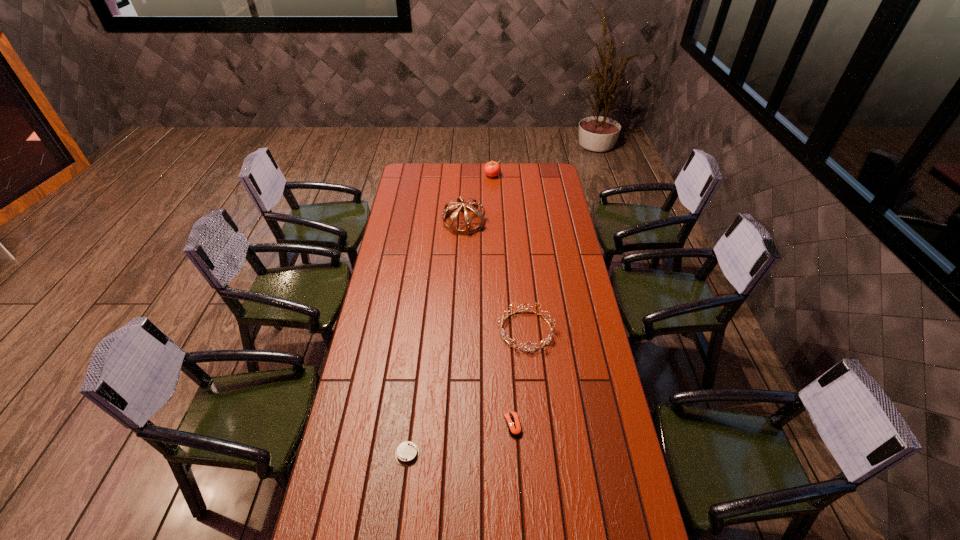
The width and height of the screenshot is (960, 540). What are the coordinates of `vacant point located 0.150m on the right of the taller tiara` in the screenshot? It's located at (515, 222).

You are a GUI agent. You are given a task and a screenshot of the screen. Output one action in this format:
    pyautogui.click(x=<x>, y=<y>)
    Task: Click on the free space located 0.310m on the left of the fourth shortest object
    
    Given the screenshot: What is the action you would take?
    pyautogui.click(x=431, y=176)

At what (x,y) coordinates should I click in order to perform the action: click on vacant region located 0.240m on the front-facing side of the shorter tiara. Please return your answer as a coordinate pair (x, y). Image resolution: width=960 pixels, height=540 pixels. Looking at the image, I should click on (438, 330).

Find the location of a particular element. This screenshot has height=540, width=960. vacant space located on the front-facing side of the shorter tiara is located at coordinates (436, 330).

At what (x,y) coordinates should I click in order to perform the action: click on free space located on the front-facing side of the shorter tiara. Please return your answer as a coordinate pair (x, y). This screenshot has width=960, height=540. Looking at the image, I should click on (450, 330).

Find the location of `free space located on the right of the computer mouse`. free space located on the right of the computer mouse is located at coordinates (590, 425).

The height and width of the screenshot is (540, 960). I want to click on vacant region located on the back of the chocolate cake, so click(x=413, y=408).

The width and height of the screenshot is (960, 540). Identify the location of object at the far edge. click(492, 169).

The image size is (960, 540). In the image, there is a desktop. Find the location of `free space at the far edge`. free space at the far edge is located at coordinates (465, 178).

Where is `vacant space at the left edge`? This screenshot has height=540, width=960. vacant space at the left edge is located at coordinates (333, 535).